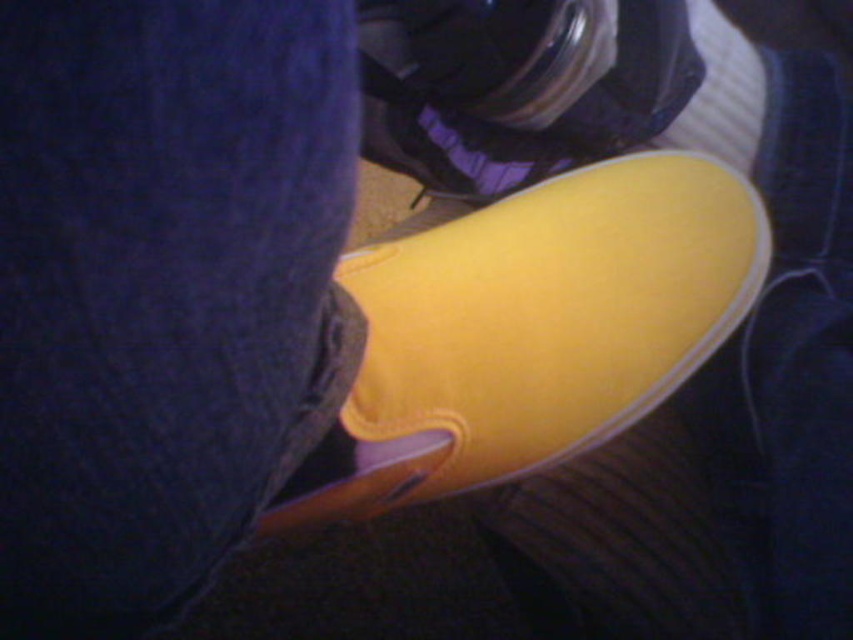
Question: Which of the following is the closest to the observer?

Choices:
 (A) (426, 29)
 (B) (527, 200)

Answer: (A)

Question: Is yellow canvas shoe at center wider than yellow fabric shoe at center?

Choices:
 (A) no
 (B) yes

Answer: (B)

Question: Can you confirm if yellow canvas shoe at center is wider than yellow fabric shoe at center?

Choices:
 (A) yes
 (B) no

Answer: (A)

Question: Can you confirm if yellow canvas shoe at center is thinner than yellow fabric shoe at center?

Choices:
 (A) no
 (B) yes

Answer: (A)